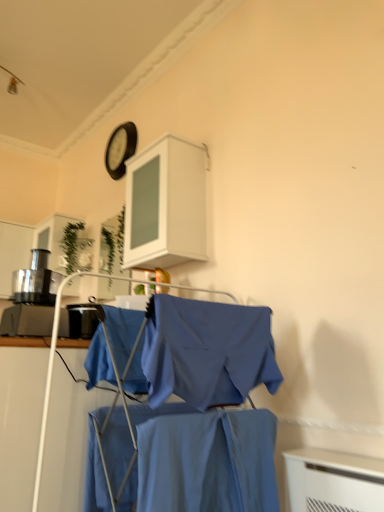
In order to face blue cotton shirt at center, the second fabric from the front, should I rotate leftwards or rightwards?

Turn left approximately 9.788 degrees to face it.

Describe the element at coordinates (112, 245) in the screenshot. I see `green glass plant at upper center, which is the 1th plant in right-to-left order` at that location.

Describe the element at coordinates (120, 149) in the screenshot. Image resolution: width=384 pixels, height=512 pixels. I see `black matte clock at upper center` at that location.

Locate an element on the screen. The image size is (384, 512). black matte clock at upper center is located at coordinates (120, 149).

What do you see at coordinates (207, 351) in the screenshot? I see `blue fabric shirt at center` at bounding box center [207, 351].

Locate an element on the screen. blue fabric shirt at center is located at coordinates (205, 410).

Looking at their sizes, would you say blue fabric shirt at center is wider or thinner than blue cotton shirt at center, which appears as the 1th fabric when viewed from the left?

Clearly, blue fabric shirt at center has more width compared to blue cotton shirt at center, which appears as the 1th fabric when viewed from the left.

Is blue fabric shirt at center located outside blue cotton shirt at center, the 2th fabric when ordered from right to left?

Yes, blue fabric shirt at center is not within blue cotton shirt at center, the 2th fabric when ordered from right to left.

What are the coordinates of `laundry in front of the blue cotton shirt at center, which appears as the 1th fabric when viewed from the left` in the screenshot? It's located at (205, 410).

Which is in front, blue fabric shirt at center or blue cotton shirt at center, which appears as the 1th fabric when viewed from the left?

blue fabric shirt at center is in front.

From the picture: Could black matte clock at upper center be considered to be inside green glass plant at upper center, which is the 1th plant in right-to-left order?

No, black matte clock at upper center is located outside of green glass plant at upper center, which is the 1th plant in right-to-left order.

Could you tell me if green glass plant at upper center, which is the 1th plant in right-to-left order, is turned towards black matte clock at upper center?

No, green glass plant at upper center, which is the 1th plant in right-to-left order, is not turned towards black matte clock at upper center.

Considering the sizes of objects green glass plant at upper center, which is the 1th plant in right-to-left order, and black matte clock at upper center in the image provided, who is taller, green glass plant at upper center, which is the 1th plant in right-to-left order, or black matte clock at upper center?

With more height is green glass plant at upper center, which is the 1th plant in right-to-left order.

What's the angular difference between green glass plant at upper center, which is counted as the second plant, starting from the left, and black matte clock at upper center's facing directions?

They differ by 0.000382 degrees in their facing directions.

Could you tell me if black matte clock at upper center is facing blue fabric shirt at center?

No.

Is black matte clock at upper center at the right side of blue fabric shirt at center?

No, black matte clock at upper center is not to the right of blue fabric shirt at center.

Considering the relative sizes of black matte clock at upper center and blue fabric shirt at center in the image provided, is black matte clock at upper center taller than blue fabric shirt at center?

Yes, black matte clock at upper center is taller than blue fabric shirt at center.

From the image's perspective, is black matte clock at upper center beneath blue fabric shirt at center?

No.

Considering the sizes of objects black matte clock at upper center and smooth cotton shirt at center, the 2th fabric from the left, in the image provided, who is taller, black matte clock at upper center or smooth cotton shirt at center, the 2th fabric from the left,?

black matte clock at upper center.

Does black matte clock at upper center have a smaller size compared to smooth cotton shirt at center, the 2th fabric from the left?

Yes.

Would you say black matte clock at upper center is inside or outside smooth cotton shirt at center, which is the 1th fabric in front-to-back order?

black matte clock at upper center is not enclosed by smooth cotton shirt at center, which is the 1th fabric in front-to-back order.

Can you confirm if green matte plant at upper center, arranged as the first plant when viewed from the left, is wider than white matte cabinet at upper center?

No, green matte plant at upper center, arranged as the first plant when viewed from the left, is not wider than white matte cabinet at upper center.

Would you consider green matte plant at upper center, arranged as the first plant when viewed from the left, to be distant from white matte cabinet at upper center?

Absolutely, green matte plant at upper center, arranged as the first plant when viewed from the left, is distant from white matte cabinet at upper center.

From a real-world perspective, is green matte plant at upper center, which is counted as the second plant, starting from the right, physically located above or below white matte cabinet at upper center?

Clearly, from a real-world perspective, green matte plant at upper center, which is counted as the second plant, starting from the right, is above white matte cabinet at upper center.

Does point (121, 265) come farther from viewer compared to point (74, 258)?

No, it is not.

Is green glass plant at upper center, which is counted as the second plant, starting from the left, oriented towards green matte plant at upper center, which is counted as the second plant, starting from the right?

No.

Relative to green matte plant at upper center, arranged as the first plant when viewed from the left, is green glass plant at upper center, which is counted as the second plant, starting from the left, in front or behind?

green glass plant at upper center, which is counted as the second plant, starting from the left, is in front of green matte plant at upper center, arranged as the first plant when viewed from the left.

Which of these two, green glass plant at upper center, which is the 1th plant in right-to-left order, or green matte plant at upper center, arranged as the first plant when viewed from the left, is thinner?

green glass plant at upper center, which is the 1th plant in right-to-left order.

Starting from the green glass plant at upper center, which is counted as the second plant, starting from the left, which fabric is the 2nd one in front? Please provide its 2D coordinates.

[(208, 462)]

Can you confirm if smooth cotton shirt at center, the 2th fabric from the left, is taller than green glass plant at upper center, which is the 1th plant in right-to-left order?

No, smooth cotton shirt at center, the 2th fabric from the left, is not taller than green glass plant at upper center, which is the 1th plant in right-to-left order.

Considering the points (157, 510) and (121, 243), which point is in front, point (157, 510) or point (121, 243)?

The point (157, 510) is closer to the camera.

Is smooth cotton shirt at center, the 2th fabric from the left, oriented away from green glass plant at upper center, which is counted as the second plant, starting from the left?

smooth cotton shirt at center, the 2th fabric from the left, does not have its back to green glass plant at upper center, which is counted as the second plant, starting from the left.

At what (x,y) coordinates should I click in order to perform the action: click on fabric above the blue fabric shirt at center (from the image's perspective). Please return your answer as a coordinate pair (x, y). The width and height of the screenshot is (384, 512). Looking at the image, I should click on (122, 332).

Locate an element on the screen. The image size is (384, 512). the 2nd plant below when counting from the black matte clock at upper center (from the image's perspective) is located at coordinates (112, 245).

When comparing their distances from blue fabric shirt at center, does green glass plant at upper center, which is counted as the second plant, starting from the left, or smooth cotton shirt at center, which is the 1th fabric in front-to-back order, seem further?

green glass plant at upper center, which is counted as the second plant, starting from the left, lies further to blue fabric shirt at center than the other object.

Looking at the image, which one is located further to black matte clock at upper center, blue cotton shirt at center, the 2th fabric when ordered from right to left, or blue fabric shirt at center?

blue fabric shirt at center.

Which object lies nearer to the anchor point green matte plant at upper center, arranged as the first plant when viewed from the left, green glass plant at upper center, which is the 1th plant in right-to-left order, or black matte clock at upper center?

green glass plant at upper center, which is the 1th plant in right-to-left order, is positioned closer to the anchor green matte plant at upper center, arranged as the first plant when viewed from the left.

Considering their positions, is green glass plant at upper center, which is the 1th plant in right-to-left order, positioned closer to blue fabric shirt at center than green matte plant at upper center, arranged as the first plant when viewed from the left?

green glass plant at upper center, which is the 1th plant in right-to-left order, is positioned closer to the anchor blue fabric shirt at center.

Based on their spatial positions, is blue cotton shirt at center, the 2th fabric when ordered from right to left, or blue fabric shirt at center further from white matte cabinet at upper center?

blue fabric shirt at center is further to white matte cabinet at upper center.

Which object lies further to the anchor point green matte plant at upper center, arranged as the first plant when viewed from the left, blue cotton shirt at center, which appears as the 1th fabric when viewed from the left, or green glass plant at upper center, which is the 1th plant in right-to-left order?

blue cotton shirt at center, which appears as the 1th fabric when viewed from the left.

Based on their spatial positions, is blue fabric shirt at center or blue fabric shirt at center further from white matte cabinet at upper center?

blue fabric shirt at center is positioned further to the anchor white matte cabinet at upper center.

Considering their positions, is green matte plant at upper center, which is counted as the second plant, starting from the right, positioned further to black matte clock at upper center than blue fabric shirt at center?

blue fabric shirt at center is further to black matte clock at upper center.

This screenshot has height=512, width=384. I want to click on cloak positioned between smooth cotton shirt at center, which is the 1th fabric in front-to-back order, and green matte plant at upper center, arranged as the first plant when viewed from the left, from near to far, so click(x=207, y=351).

Find the location of a particular element. The height and width of the screenshot is (512, 384). fabric between smooth cotton shirt at center, the 1th fabric positioned from the right, and green matte plant at upper center, which is counted as the second plant, starting from the right, along the z-axis is located at coordinates (122, 332).

Find the location of a particular element. laundry that lies between blue fabric shirt at center and smooth cotton shirt at center, the 1th fabric positioned from the right, from top to bottom is located at coordinates (205, 410).

Locate an element on the screen. This screenshot has height=512, width=384. plant positioned between blue fabric shirt at center and green matte plant at upper center, arranged as the first plant when viewed from the left, from near to far is located at coordinates (112, 245).